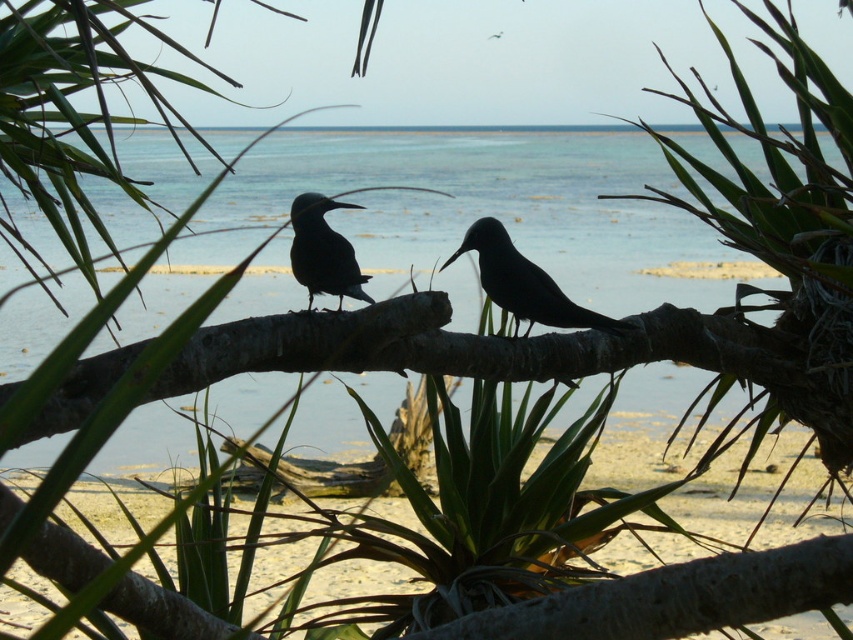
You are a photographer trying to capture a shot of the shiny black bird at center and the clear blue water at center. From your current position, which object is located to the right?

The shiny black bird at center is located to the right of the clear blue water at center.

You are observing two black birds perched on a branch in a coastal scene. Which of the two birds, the black glossy bird at center or the shiny black bird at center, is located to the right?

The black glossy bird at center is positioned on the right side of the shiny black bird at center, so it is located to the right.